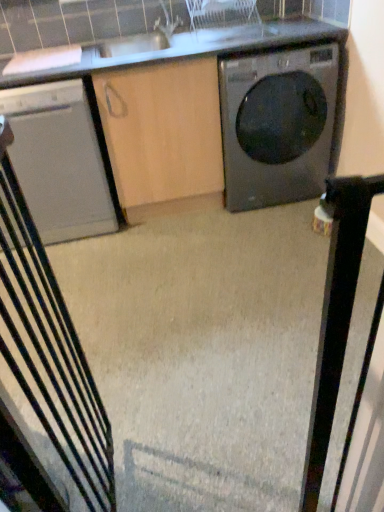
Question: Can you confirm if metallic gray rocking chair at left is positioned to the left of matte black washing machine at right?

Choices:
 (A) no
 (B) yes

Answer: (B)

Question: Considering the relative sizes of metallic gray rocking chair at left and matte black washing machine at right in the image provided, is metallic gray rocking chair at left shorter than matte black washing machine at right?

Choices:
 (A) no
 (B) yes

Answer: (A)

Question: From the image's perspective, is metallic gray rocking chair at left below matte black washing machine at right?

Choices:
 (A) yes
 (B) no

Answer: (A)

Question: From the image's perspective, is metallic gray rocking chair at left on matte black washing machine at right?

Choices:
 (A) yes
 (B) no

Answer: (B)

Question: Does metallic gray rocking chair at left have a smaller size compared to matte black washing machine at right?

Choices:
 (A) no
 (B) yes

Answer: (B)

Question: Is metallic gray rocking chair at left in contact with matte black washing machine at right?

Choices:
 (A) yes
 (B) no

Answer: (B)

Question: Is white glossy countertop at upper center bigger than matte black washing machine at right?

Choices:
 (A) no
 (B) yes

Answer: (A)

Question: Is white glossy countertop at upper center aimed at matte black washing machine at right?

Choices:
 (A) no
 (B) yes

Answer: (A)

Question: From a real-world perspective, is white glossy countertop at upper center positioned under matte black washing machine at right based on gravity?

Choices:
 (A) yes
 (B) no

Answer: (B)

Question: Does white glossy countertop at upper center lie in front of matte black washing machine at right?

Choices:
 (A) no
 (B) yes

Answer: (B)

Question: Does white glossy countertop at upper center appear on the left side of matte black washing machine at right?

Choices:
 (A) yes
 (B) no

Answer: (A)

Question: Does white glossy countertop at upper center have a smaller size compared to matte black washing machine at right?

Choices:
 (A) no
 (B) yes

Answer: (B)

Question: Is white glossy countertop at upper center facing towards satin white dishwasher at left?

Choices:
 (A) no
 (B) yes

Answer: (A)